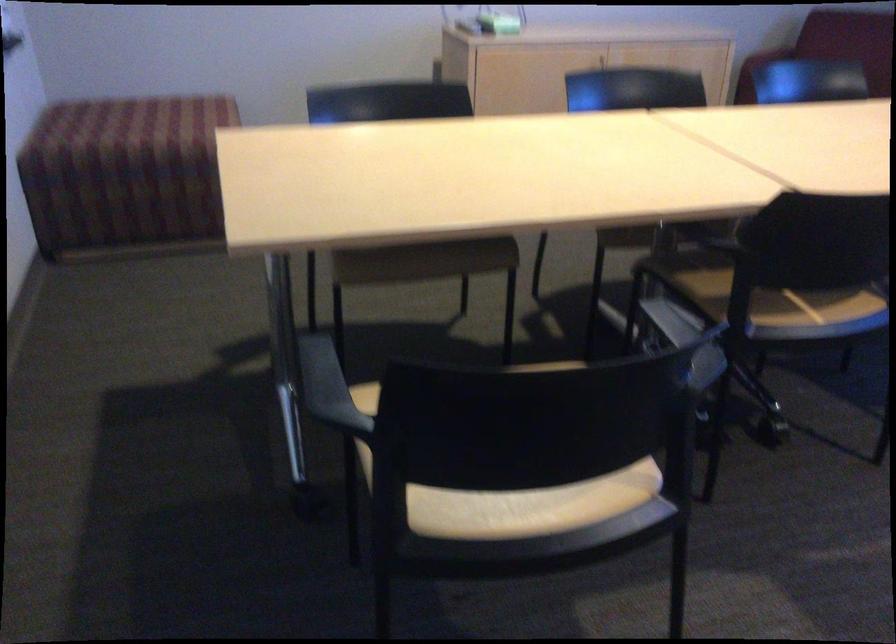
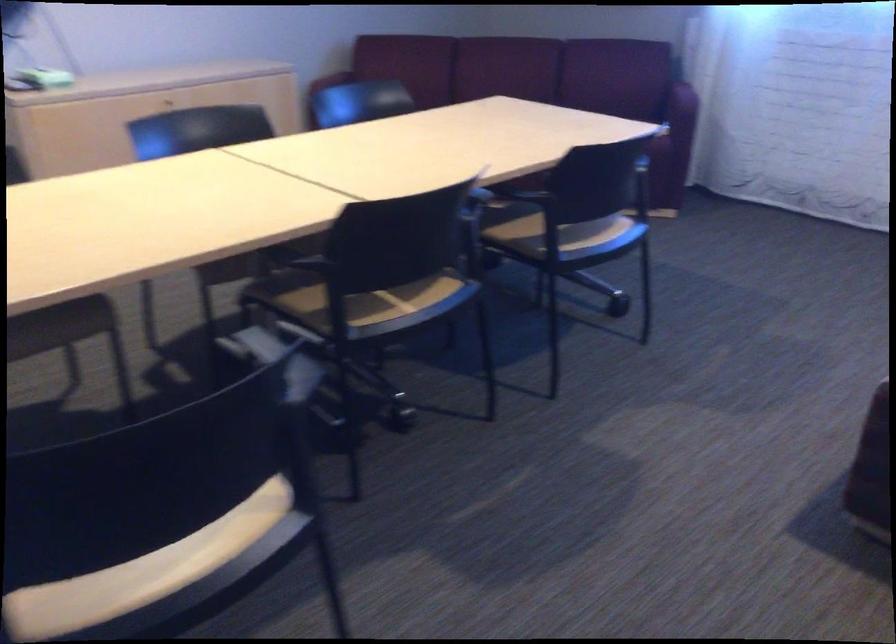
The images are taken continuously from a first-person perspective. In which direction are you moving?

The cameraman moved toward right, backward.